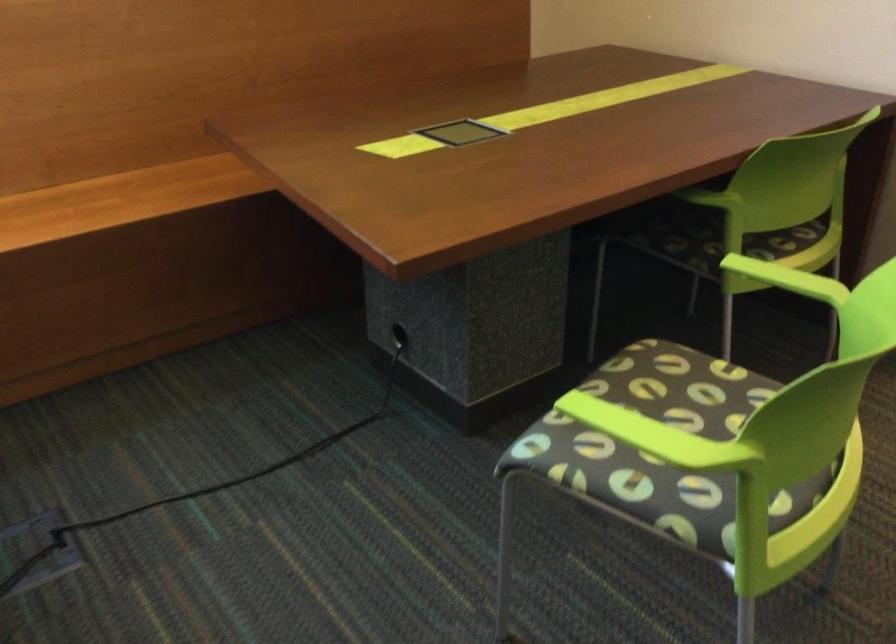
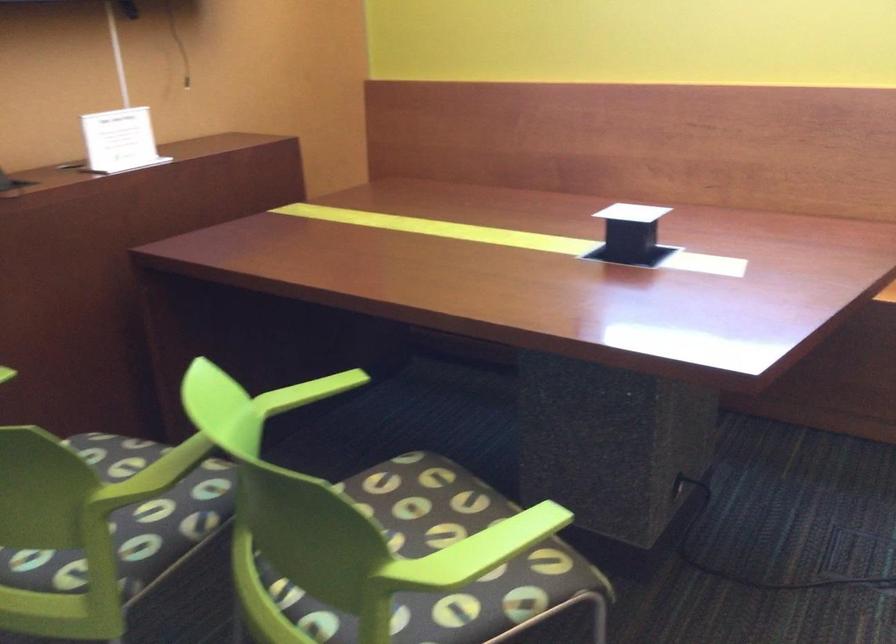
Question: Based on the continuous images, in which direction is the camera rotating? Reply with the corresponding letter.

Choices:
 (A) Left
 (B) Right
 (C) Up
 (D) Down

Answer: (A)